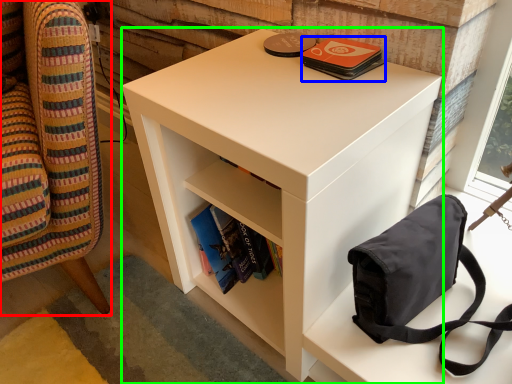
Question: Which is nearer to the furniture (highlighted by a red box)? paperback book (highlighted by a blue box) or nightstand (highlighted by a green box).

Choices:
 (A) paperback book
 (B) nightstand

Answer: (B)